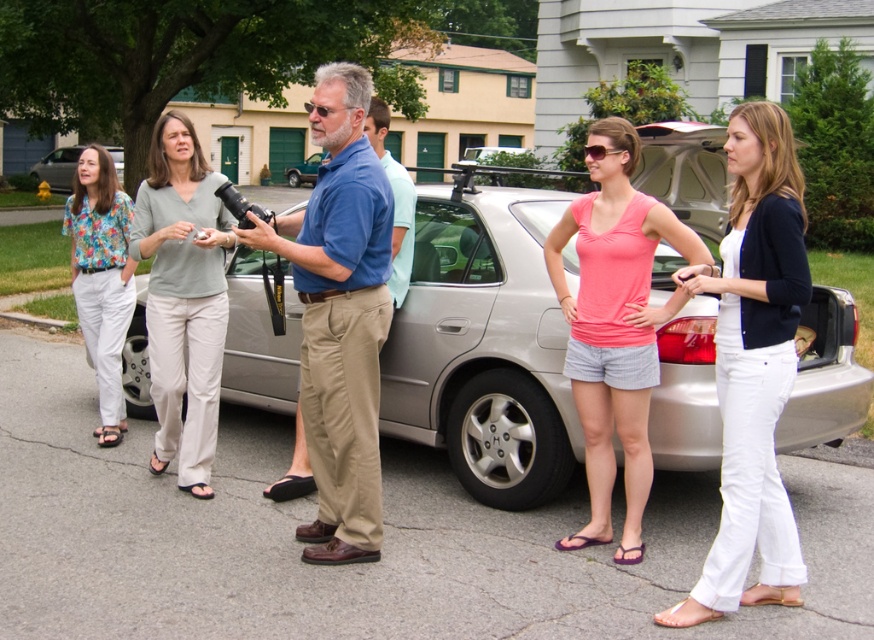
Who is shorter, white cotton pants at center or light beige pants at center?

Standing shorter between the two is white cotton pants at center.

Locate an element on the screen. This screenshot has height=640, width=874. white cotton pants at center is located at coordinates (753, 365).

At what (x,y) coordinates should I click in order to perform the action: click on white cotton pants at center. Please return your answer as a coordinate pair (x, y). The width and height of the screenshot is (874, 640). Looking at the image, I should click on pyautogui.click(x=753, y=365).

The width and height of the screenshot is (874, 640). What are the coordinates of `white cotton pants at center` in the screenshot? It's located at (753, 365).

Which of these two, white cotton pants at center or pink fabric tank top at center, stands taller?

white cotton pants at center is taller.

Find the location of `white cotton pants at center`. white cotton pants at center is located at coordinates (753, 365).

Between point (660, 236) and point (53, 160), which one is positioned behind?

Point (53, 160)

Between pink fabric tank top at center and matte silver sedan at left, which one has less height?

Standing shorter between the two is pink fabric tank top at center.

Is point (585, 416) in front of point (36, 163)?

Yes, point (585, 416) is in front of point (36, 163).

The width and height of the screenshot is (874, 640). I want to click on pink fabric tank top at center, so click(615, 323).